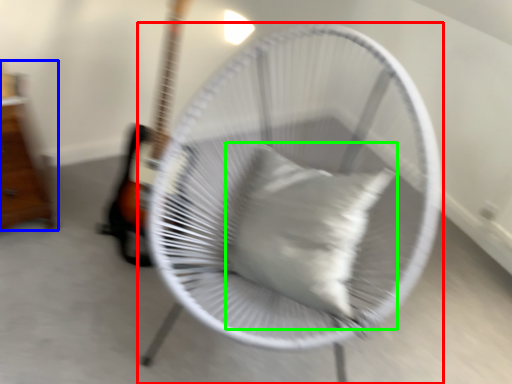
Question: Which object is positioned farthest from mechanical fan (highlighted by a red box)? Select from furniture (highlighted by a blue box) and pillow (highlighted by a green box).

Choices:
 (A) furniture
 (B) pillow

Answer: (A)